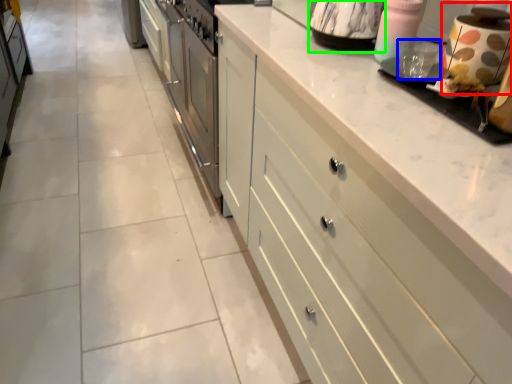
Question: Which object is the farthest from appliance (highlighted by a red box)? Choose among these: appliance (highlighted by a blue box) or appliance (highlighted by a green box).

Choices:
 (A) appliance
 (B) appliance

Answer: (B)